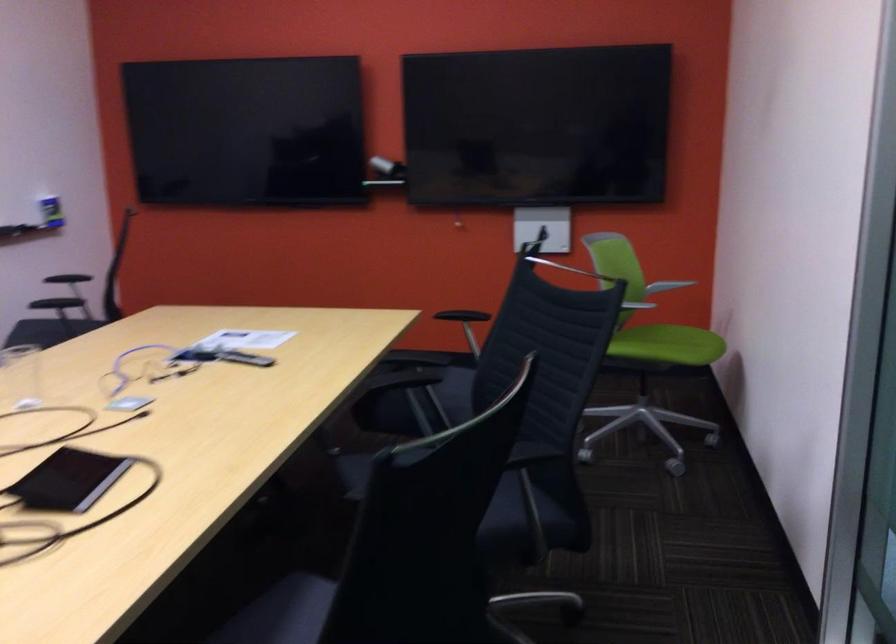
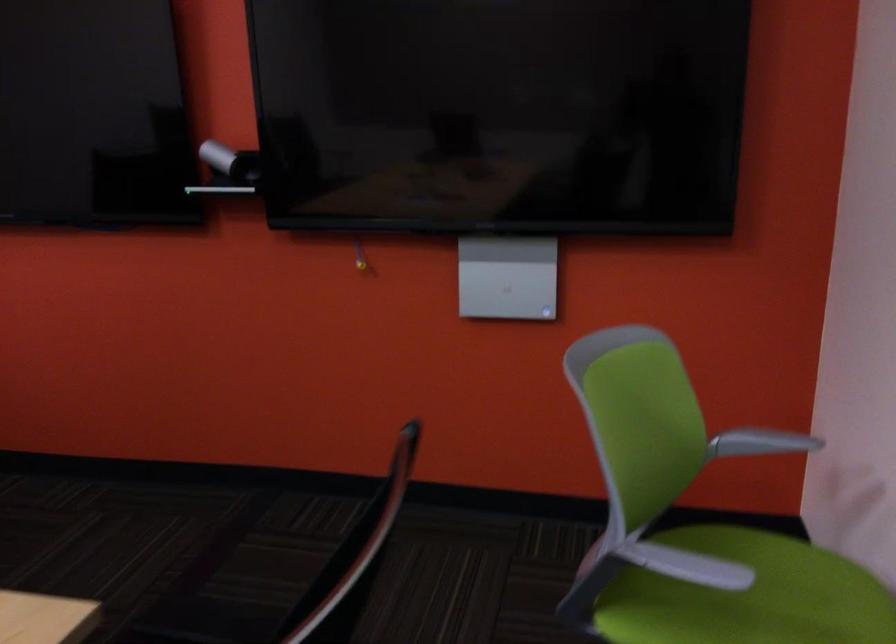
Locate, in the second image, the point that corresponds to the point at 394,156 in the first image.

(230, 162)